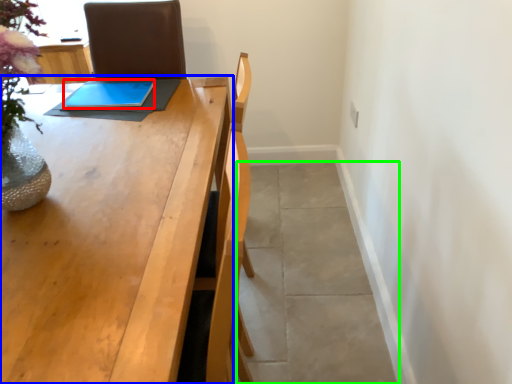
Question: Which is nearer to the tablet computer (highlighted by a red box)? table (highlighted by a blue box) or concrete (highlighted by a green box).

Choices:
 (A) table
 (B) concrete

Answer: (A)